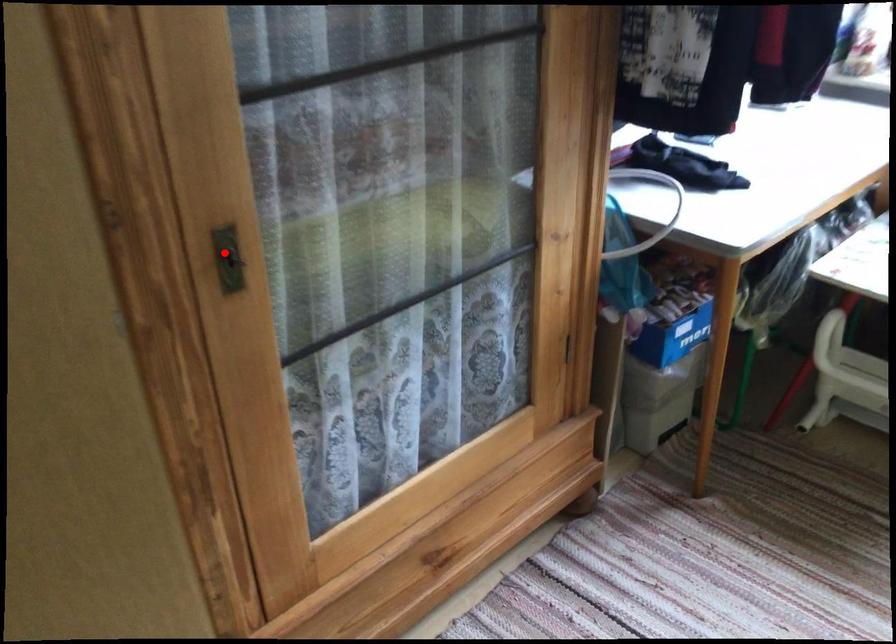
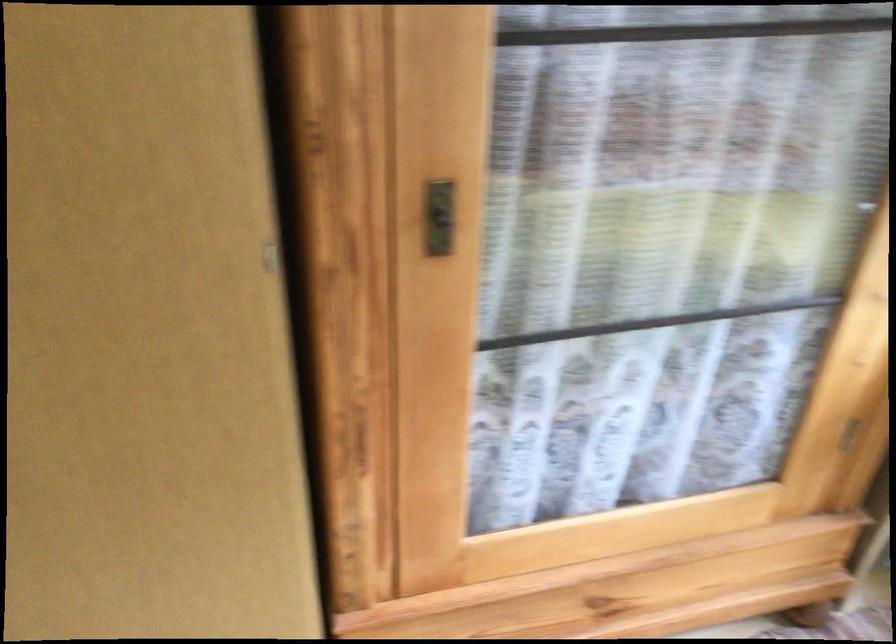
Question: I am providing you with two images of the same scene from different viewpoints. Given a red point in image1, look at the same physical point in image2. Is it:

Choices:
 (A) Closer to the viewpoint
 (B) Farther from the viewpoint

Answer: (A)